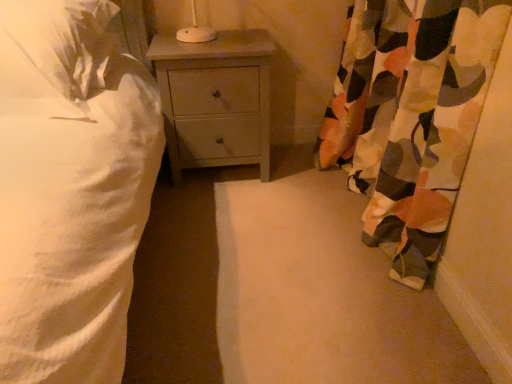
Question: In terms of height, does white soft pillow at upper left look taller or shorter compared to light gray wood nightstand at center?

Choices:
 (A) tall
 (B) short

Answer: (B)

Question: Is white soft pillow at upper left inside the boundaries of light gray wood nightstand at center, or outside?

Choices:
 (A) outside
 (B) inside

Answer: (A)

Question: Considering the real-world distances, which object is closest to the camouflage fabric curtain at right?

Choices:
 (A) white soft pillow at upper left
 (B) light gray wood nightstand at center

Answer: (B)

Question: Which of these objects is positioned farthest from the light gray wood nightstand at center?

Choices:
 (A) white soft pillow at upper left
 (B) camouflage fabric curtain at right

Answer: (B)